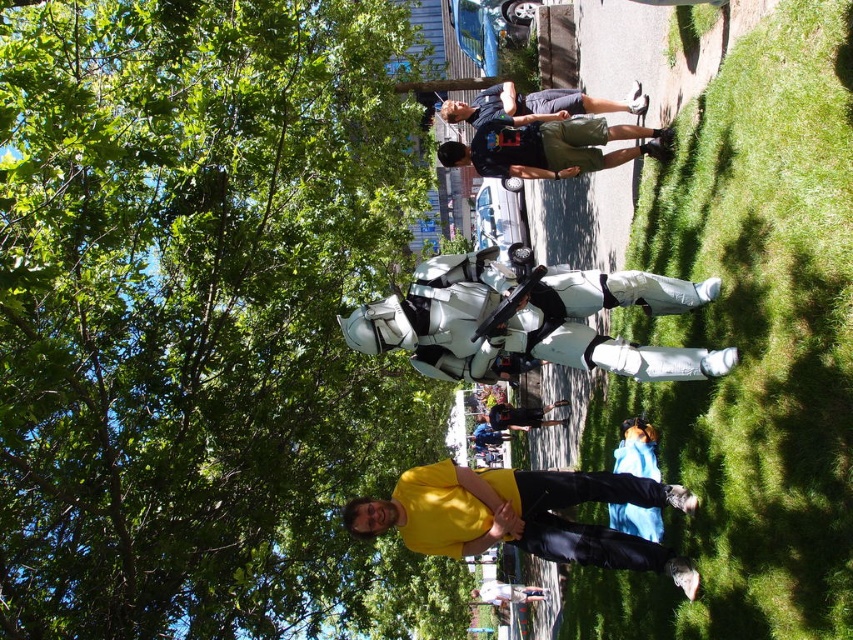
You are a photographer trying to capture a clear photo of the yellow matte shirt at lower center. However, the green leafy tree at upper left is blocking part of the view. Can you adjust your position to avoid the tree while still focusing on the shirt?

The green leafy tree at upper left is positioned over the yellow matte shirt at lower center, so moving to the side or adjusting the angle could allow you to avoid the tree while keeping the shirt in focus.